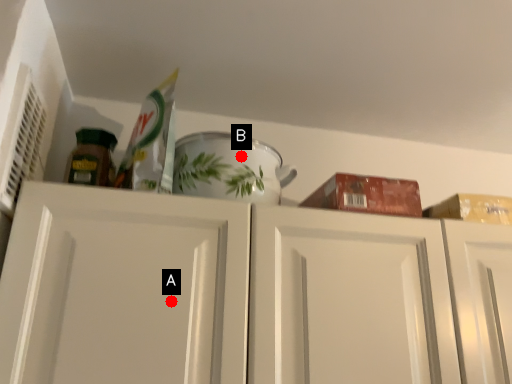
Question: Two points are circled on the image, labeled by A and B beside each circle. Which point is closer to the camera taking this photo?

Choices:
 (A) A is closer
 (B) B is closer

Answer: (A)